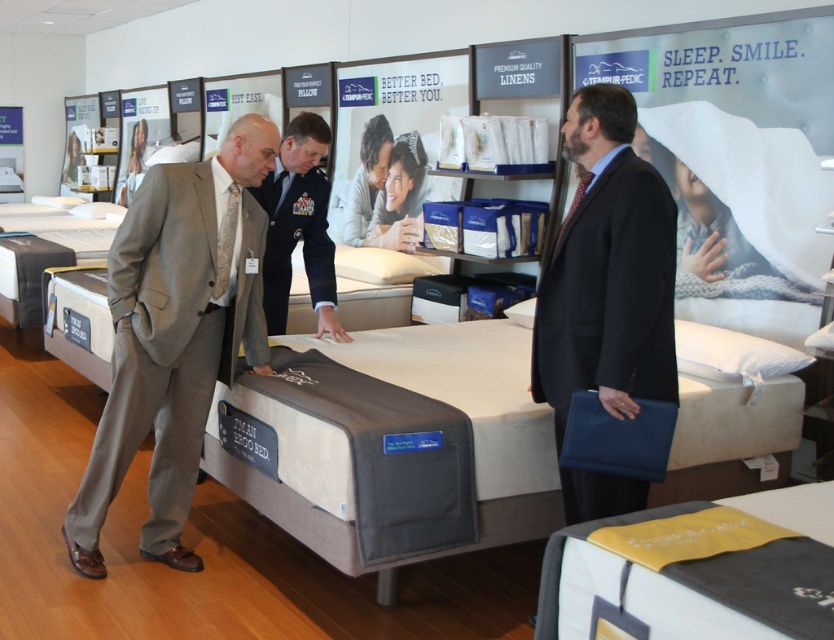
You are a customer in a furniture store and want to know if the beige fabric mattress at center can fit through the doorway of your apartment. The doorway is 1.2 meters wide. The gray wool suit at left is 0.5 meters wide. Can the mattress fit through the doorway?

The beige fabric mattress at center is wider than the gray wool suit at left, which is 0.5 meters wide. Since the doorway is 1.2 meters wide, the mattress would need to be less than or equal to 1.2 meters in width. However, since the mattress is wider than the 0.5 meters suit, but we don not have the exact width of the mattress, we cannot definitively determine if it will fit through the 1.2 meter doorway.

You are standing in the furniture store and want to determine which of the two points, point (197, 385) or point (49, 208), is nearer to you. Based on the scene description, which point is closer?

Point (197, 385) is closer to the viewer than point (49, 208).